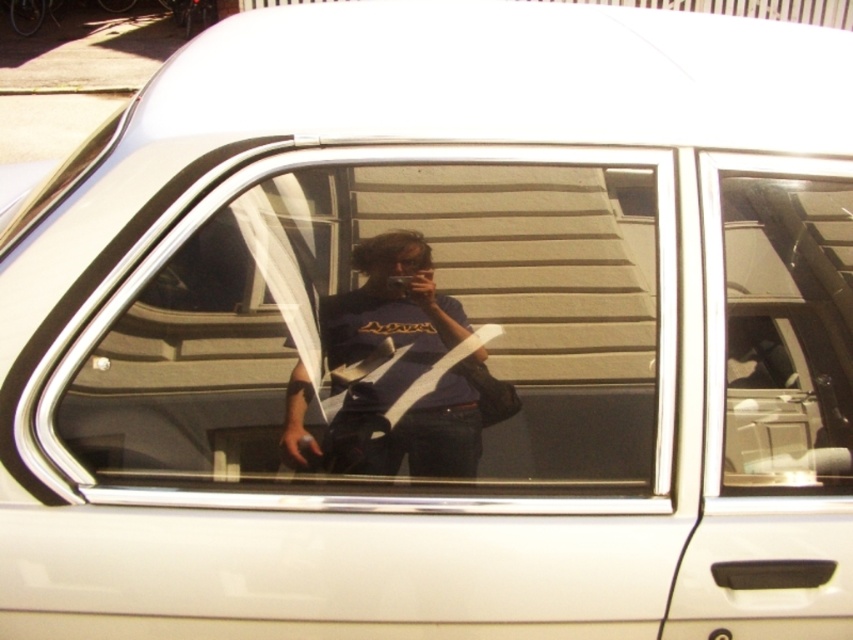
Which is more to the left, clear glass window at center or transparent glass car window at center?

Positioned to the left is clear glass window at center.

Can you confirm if clear glass window at center is wider than transparent glass car window at center?

Yes, clear glass window at center is wider than transparent glass car window at center.

Is point (425, 445) positioned after point (724, 198)?

Yes, it is behind point (724, 198).

Find the location of a particular element. The height and width of the screenshot is (640, 853). clear glass window at center is located at coordinates (387, 333).

How distant is clear glass window at center from matte black t-shirt at center?

A distance of 2.77 inches exists between clear glass window at center and matte black t-shirt at center.

Locate an element on the screen. This screenshot has width=853, height=640. clear glass window at center is located at coordinates (387, 333).

I want to click on clear glass window at center, so click(387, 333).

Does transparent glass car window at center have a larger size compared to matte black t-shirt at center?

Yes.

Does transparent glass car window at center have a lesser height compared to matte black t-shirt at center?

Incorrect, transparent glass car window at center's height does not fall short of matte black t-shirt at center's.

Identify the location of transparent glass car window at center. This screenshot has height=640, width=853. (782, 321).